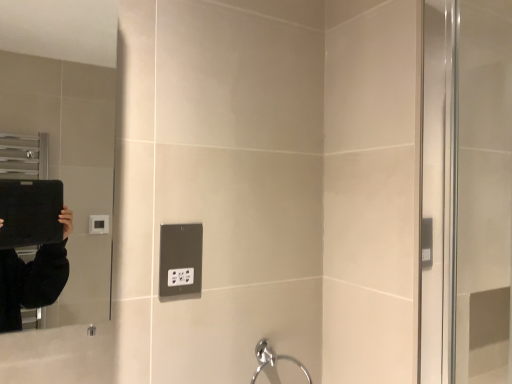
In order to click on chrome metallic faucet at lower center in this screenshot , I will do `click(273, 359)`.

What do you see at coordinates (67, 127) in the screenshot? I see `matte black mirror at left` at bounding box center [67, 127].

What do you see at coordinates (180, 259) in the screenshot? The height and width of the screenshot is (384, 512). I see `black plastic outlet at center` at bounding box center [180, 259].

In order to click on chrome metallic faucet at lower center in this screenshot , I will do `click(273, 359)`.

Is black plastic outlet at center inside or outside of matte black mirror at left?

The correct answer is: outside.

Are black plastic outlet at center and matte black mirror at left far apart?

Indeed, black plastic outlet at center is not near matte black mirror at left.

From the picture: From the image's perspective, between black plastic outlet at center and matte black mirror at left, which one is located above?

From the image's view, matte black mirror at left is above.

In the scene shown: Which object is further away from the camera, black plastic outlet at center or matte black mirror at left?

black plastic outlet at center.

Looking at this image, how much distance is there between chrome metallic faucet at lower center and matte black mirror at left?

They are 1.32 meters apart.

Does point (260, 367) come farther from viewer compared to point (48, 112)?

No.

Between chrome metallic faucet at lower center and matte black mirror at left, which one is positioned in front?

matte black mirror at left is closer to the camera.

From the image's perspective, is chrome metallic faucet at lower center on matte black mirror at left?

No, from the image's perspective, chrome metallic faucet at lower center is not above matte black mirror at left.

Which is more to the right, matte black mirror at left or black plastic outlet at center?

Positioned to the right is black plastic outlet at center.

From a real-world perspective, which object stands above the other?

In real-world perspective, matte black mirror at left is above.

From the image's perspective, is matte black mirror at left on top of black plastic outlet at center?

Yes, from the image's perspective, matte black mirror at left is over black plastic outlet at center.

Which is correct: matte black mirror at left is inside chrome metallic faucet at lower center, or outside of it?

The correct answer is: outside.

Considering the relative sizes of matte black mirror at left and chrome metallic faucet at lower center in the image provided, is matte black mirror at left shorter than chrome metallic faucet at lower center?

In fact, matte black mirror at left may be taller than chrome metallic faucet at lower center.

From a real-world perspective, is matte black mirror at left above or below chrome metallic faucet at lower center?

matte black mirror at left is above chrome metallic faucet at lower center.

From the image's perspective, between matte black mirror at left and chrome metallic faucet at lower center, which one is located above?

From the image's view, matte black mirror at left is above.

From the picture: From the image's perspective, which object appears higher, black plastic outlet at center or chrome metallic faucet at lower center?

black plastic outlet at center.

Does black plastic outlet at center contain chrome metallic faucet at lower center?

Actually, chrome metallic faucet at lower center is outside black plastic outlet at center.

Between black plastic outlet at center and chrome metallic faucet at lower center, which one has less height?

With less height is black plastic outlet at center.

Considering the relative positions of black plastic outlet at center and chrome metallic faucet at lower center in the image provided, is black plastic outlet at center in front of chrome metallic faucet at lower center?

Yes, it is in front of chrome metallic faucet at lower center.

Consider the image. Does chrome metallic faucet at lower center turn towards black plastic outlet at center?

No, chrome metallic faucet at lower center is not facing towards black plastic outlet at center.

Consider the image. Which of these two, chrome metallic faucet at lower center or black plastic outlet at center, stands shorter?

With less height is black plastic outlet at center.

Considering the relative sizes of chrome metallic faucet at lower center and black plastic outlet at center in the image provided, is chrome metallic faucet at lower center smaller than black plastic outlet at center?

No, chrome metallic faucet at lower center is not smaller than black plastic outlet at center.

Is chrome metallic faucet at lower center in front of or behind black plastic outlet at center in the image?

chrome metallic faucet at lower center is behind black plastic outlet at center.

What are the coordinates of `mirror on the left side of black plastic outlet at center` in the screenshot? It's located at (67, 127).

Where is `mirror above the chrome metallic faucet at lower center (from a real-world perspective)`? This screenshot has width=512, height=384. mirror above the chrome metallic faucet at lower center (from a real-world perspective) is located at coordinates (67, 127).

Consider the image. From the image, which object appears to be nearer to matte black mirror at left, chrome metallic faucet at lower center or black plastic outlet at center?

black plastic outlet at center is closer to matte black mirror at left.

Based on their spatial positions, is matte black mirror at left or black plastic outlet at center further from chrome metallic faucet at lower center?

Based on the image, matte black mirror at left appears to be further to chrome metallic faucet at lower center.

Estimate the real-world distances between objects in this image. Which object is further from black plastic outlet at center, chrome metallic faucet at lower center or matte black mirror at left?

matte black mirror at left lies further to black plastic outlet at center than the other object.

From the image, which object appears to be nearer to chrome metallic faucet at lower center, black plastic outlet at center or matte black mirror at left?

black plastic outlet at center is positioned closer to the anchor chrome metallic faucet at lower center.

Based on the photo, looking at the image, which one is located further to black plastic outlet at center, matte black mirror at left or chrome metallic faucet at lower center?

Among the two, matte black mirror at left is located further to black plastic outlet at center.

Considering their positions, is black plastic outlet at center positioned closer to matte black mirror at left than chrome metallic faucet at lower center?

black plastic outlet at center.

Where is `electric outlet between matte black mirror at left and chrome metallic faucet at lower center in the up-down direction`? electric outlet between matte black mirror at left and chrome metallic faucet at lower center in the up-down direction is located at coordinates (180, 259).